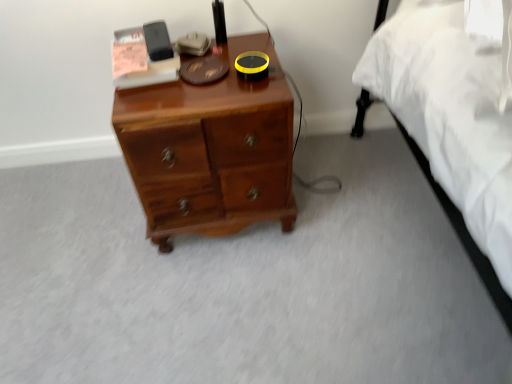
Identify the location of free space to the left of shiny wood chest of drawers at center. (89, 224).